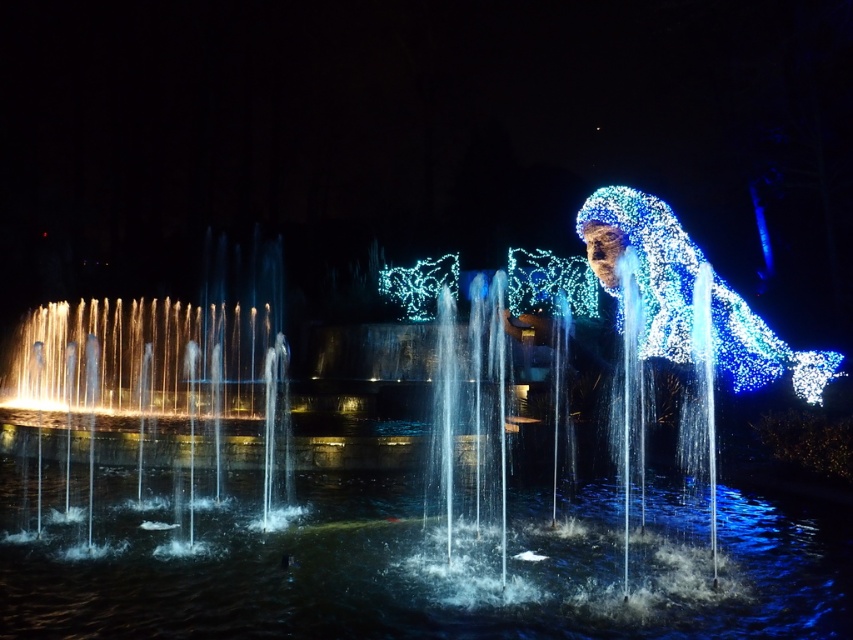
Question: Can you confirm if clear water at center is smaller than illuminated wireframe figure at right?

Choices:
 (A) yes
 (B) no

Answer: (A)

Question: Does clear water at center have a greater width compared to illuminated wireframe figure at right?

Choices:
 (A) yes
 (B) no

Answer: (A)

Question: Can you confirm if clear water at center is positioned to the left of illuminated wireframe figure at right?

Choices:
 (A) no
 (B) yes

Answer: (B)